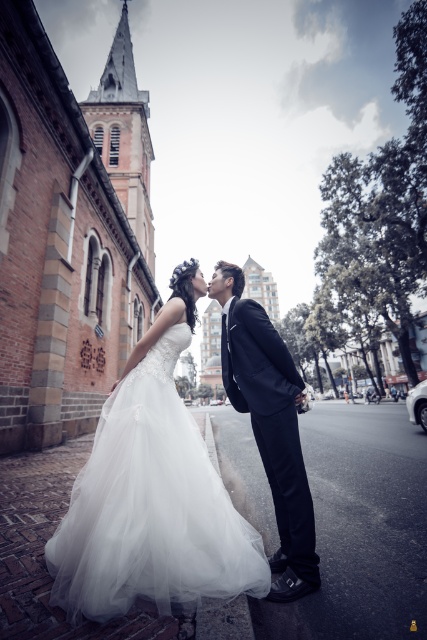
Question: Can you confirm if white tulle dress at center is positioned to the right of shiny black suit at center?

Choices:
 (A) no
 (B) yes

Answer: (A)

Question: Can you confirm if white tulle dress at center is wider than shiny black suit at center?

Choices:
 (A) no
 (B) yes

Answer: (B)

Question: Is white tulle dress at center below shiny black suit at center?

Choices:
 (A) no
 (B) yes

Answer: (B)

Question: Among these points, which one is farthest from the camera?

Choices:
 (A) (274, 362)
 (B) (149, 440)

Answer: (A)

Question: Which point appears farthest from the camera in this image?

Choices:
 (A) (199, 508)
 (B) (246, 376)

Answer: (B)